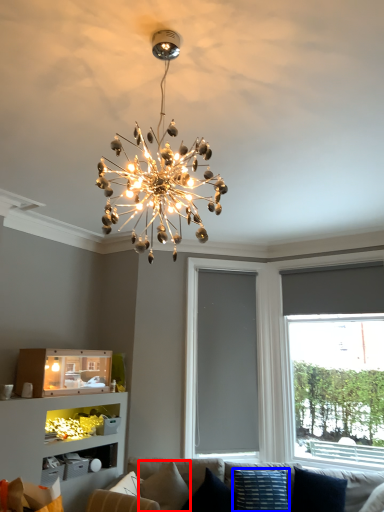
Question: Which object is closer to the camera taking this photo, pillow (highlighted by a red box) or pillow (highlighted by a blue box)?

Choices:
 (A) pillow
 (B) pillow

Answer: (B)